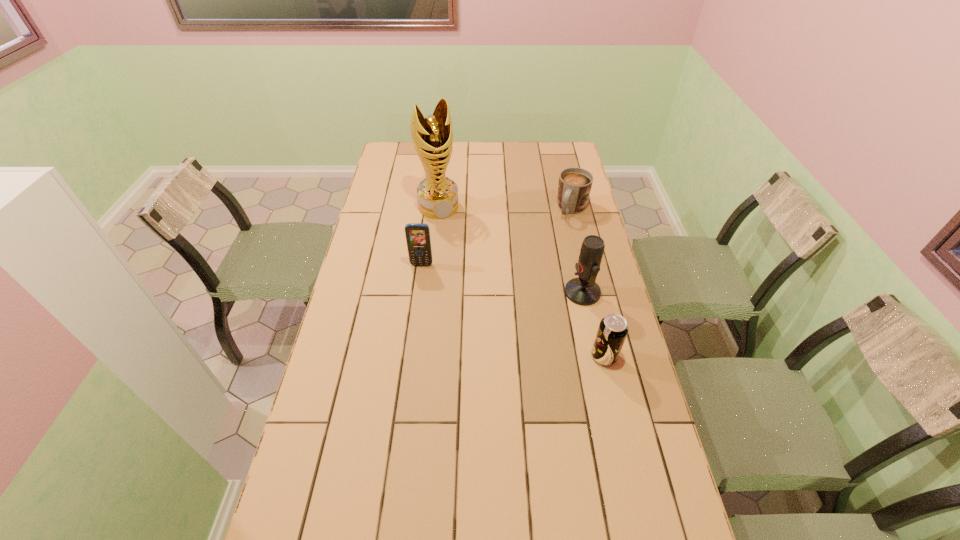
Where is `vacant area located on the side of the microphone with the red ring`? vacant area located on the side of the microphone with the red ring is located at coordinates (482, 315).

The image size is (960, 540). I want to click on vacant point located 0.230m on the front-facing side of the tallest object, so click(462, 255).

Locate an element on the screen. free space located 0.250m on the front-facing side of the tallest object is located at coordinates coord(464,259).

Image resolution: width=960 pixels, height=540 pixels. I want to click on vacant space located on the front-facing side of the tallest object, so click(x=457, y=245).

Where is `free location located 0.120m on the side of the mug with the handle`? free location located 0.120m on the side of the mug with the handle is located at coordinates (558, 240).

You are a GUI agent. You are given a task and a screenshot of the screen. Output one action in this format:
    pyautogui.click(x=<x>, y=<y>)
    Task: Click on the vacant space situated 0.190m on the side of the mug with the handle
    
    Given the screenshot: What is the action you would take?
    pyautogui.click(x=551, y=251)

You are a GUI agent. You are given a task and a screenshot of the screen. Output one action in this format:
    pyautogui.click(x=<x>, y=<y>)
    Task: Click on the vacant space located on the side of the mug with the handle
    This screenshot has height=540, width=960.
    Given the screenshot: What is the action you would take?
    pyautogui.click(x=550, y=252)

Where is `soda can that is positioned at the right edge`? soda can that is positioned at the right edge is located at coordinates (612, 331).

At what (x,y) coordinates should I click in order to perform the action: click on microphone situated at the right edge. Please return your answer as a coordinate pair (x, y). Looking at the image, I should click on (583, 290).

In order to click on mug positioned at the right edge in this screenshot , I will do `click(574, 187)`.